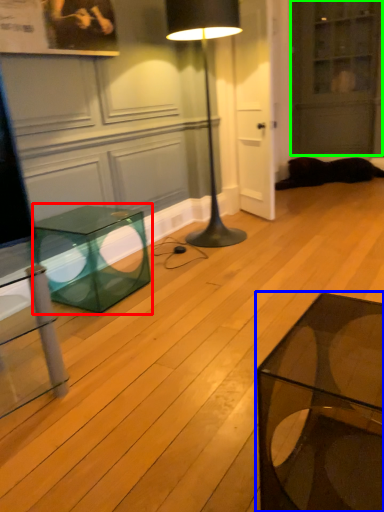
Question: Which is nearer to the table (highlighted by a red box)? coffee table (highlighted by a blue box) or glass door (highlighted by a green box).

Choices:
 (A) coffee table
 (B) glass door

Answer: (A)